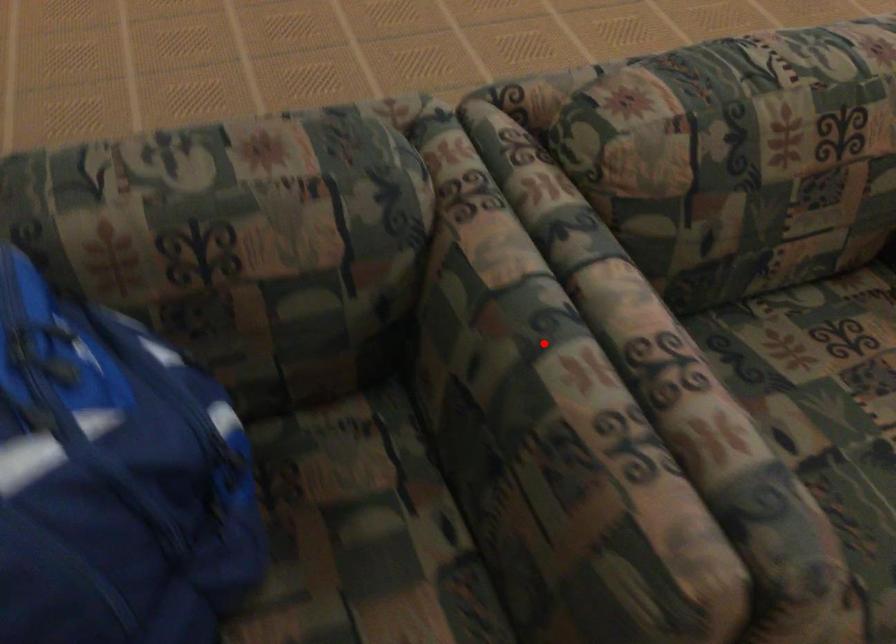
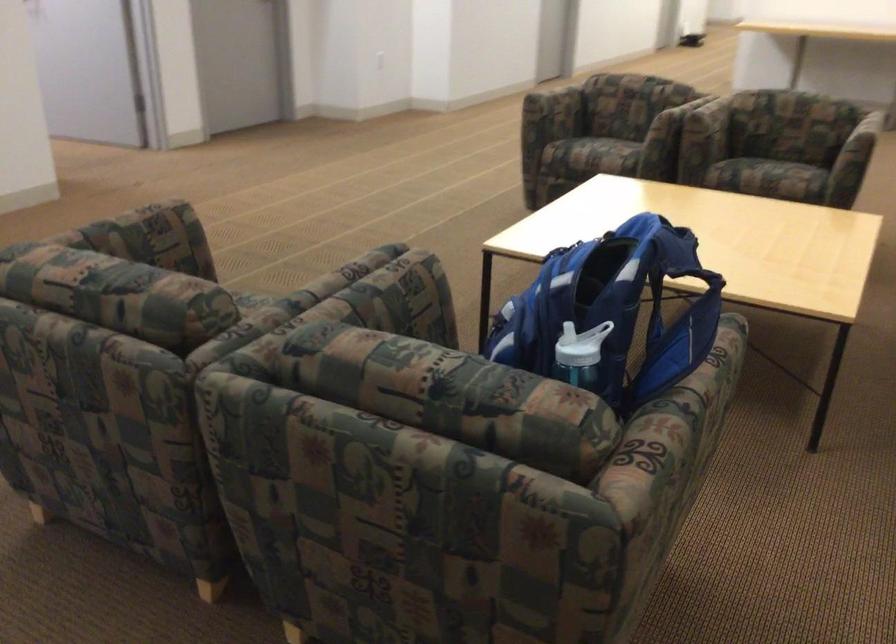
Question: I am providing you with two images of the same scene from different viewpoints. In image1, a red point is highlighted. Considering the same 3D point in image2, which of the following is correct?

Choices:
 (A) It is closer
 (B) It is farther

Answer: (B)